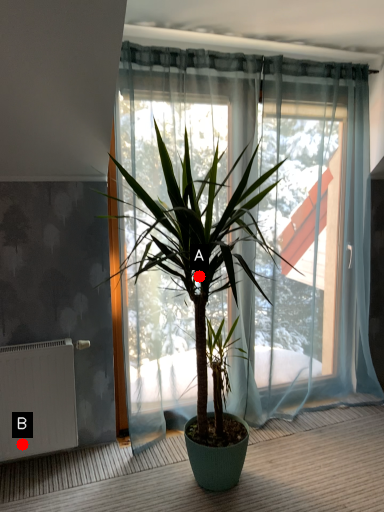
Question: Two points are circled on the image, labeled by A and B beside each circle. Which point is closer to the camera taking this photo?

Choices:
 (A) A is closer
 (B) B is closer

Answer: (A)